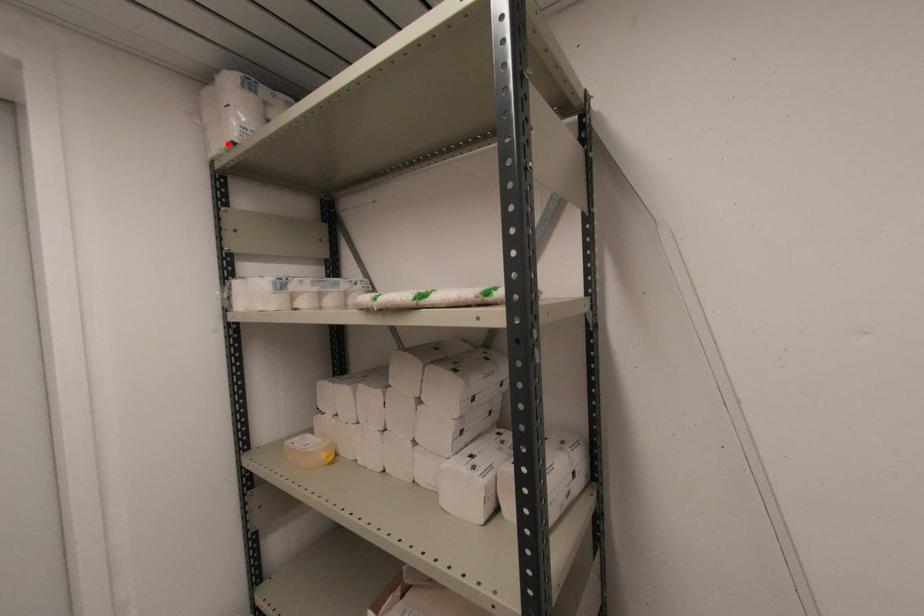
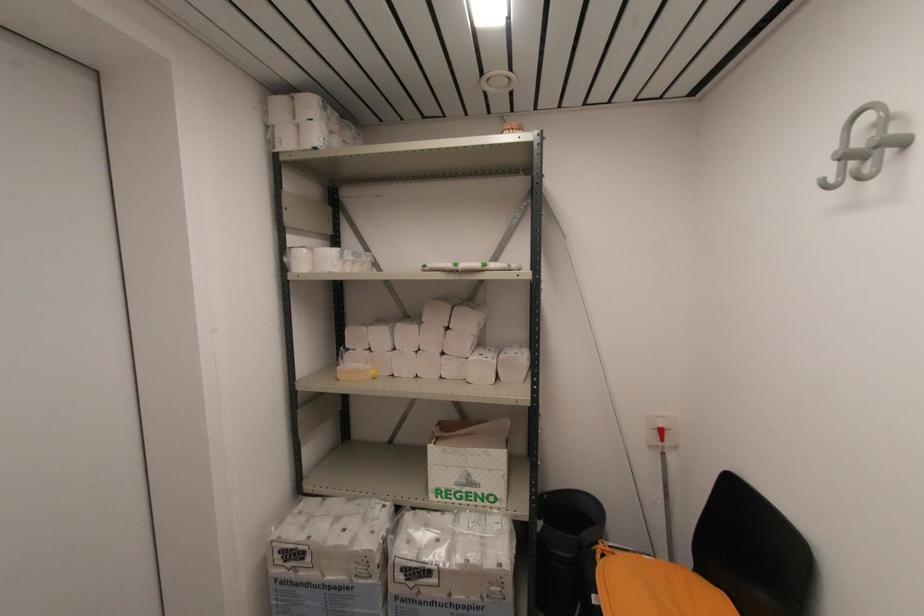
In the second image, find the point that corresponds to the highlighted location in the first image.

(310, 148)